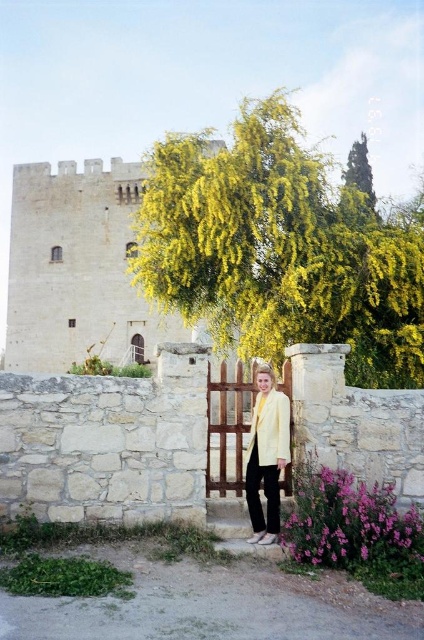
Question: Is white stone tower at upper left below wooden gate at center?

Choices:
 (A) yes
 (B) no

Answer: (B)

Question: Which point is closer to the camera?

Choices:
 (A) green leafy tree at upper right
 (B) white stone tower at upper left

Answer: (A)

Question: Which point is farther to the camera?

Choices:
 (A) (251, 392)
 (B) (268, 536)

Answer: (A)

Question: Is light yellow fabric jacket at center thinner than wooden gate at center?

Choices:
 (A) yes
 (B) no

Answer: (A)

Question: Does yellow-green foliage at center have a larger size compared to green leafy tree at upper right?

Choices:
 (A) yes
 (B) no

Answer: (A)

Question: Which object is positioned closest to the white stone tower at upper left?

Choices:
 (A) yellow-green foliage at center
 (B) wooden gate at center

Answer: (A)